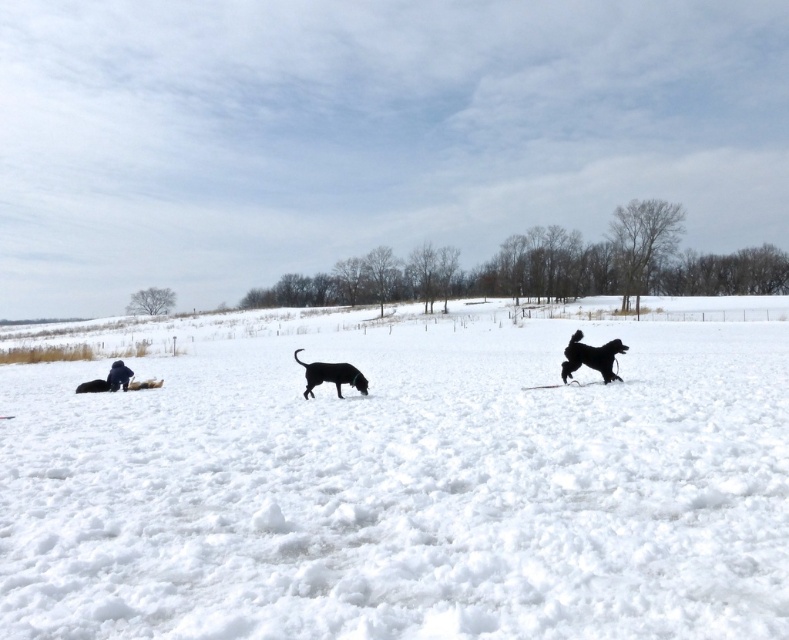
Is point (601, 372) positioned behind point (361, 394)?

That is True.

Who is higher up, black fur dog at right or black matte dog at center?

black fur dog at right is above.

Does point (593, 358) lie in front of point (350, 364)?

No, (593, 358) is further to viewer.

Where is `black fur dog at right`? Image resolution: width=789 pixels, height=640 pixels. black fur dog at right is located at coordinates (589, 356).

Which is more to the right, white fluffy snow at center or black matte dog at center?

white fluffy snow at center is more to the right.

Find the location of `white fluffy snow at center`. white fluffy snow at center is located at coordinates (404, 481).

Does white fluffy snow at center have a lesser height compared to black fur dog at right?

Incorrect, white fluffy snow at center's height does not fall short of black fur dog at right's.

Who is more distant from viewer, (352, 502) or (595, 362)?

The point (595, 362) is behind.

What do you see at coordinates (404, 481) in the screenshot? Image resolution: width=789 pixels, height=640 pixels. I see `white fluffy snow at center` at bounding box center [404, 481].

The height and width of the screenshot is (640, 789). I want to click on white fluffy snow at center, so click(x=404, y=481).